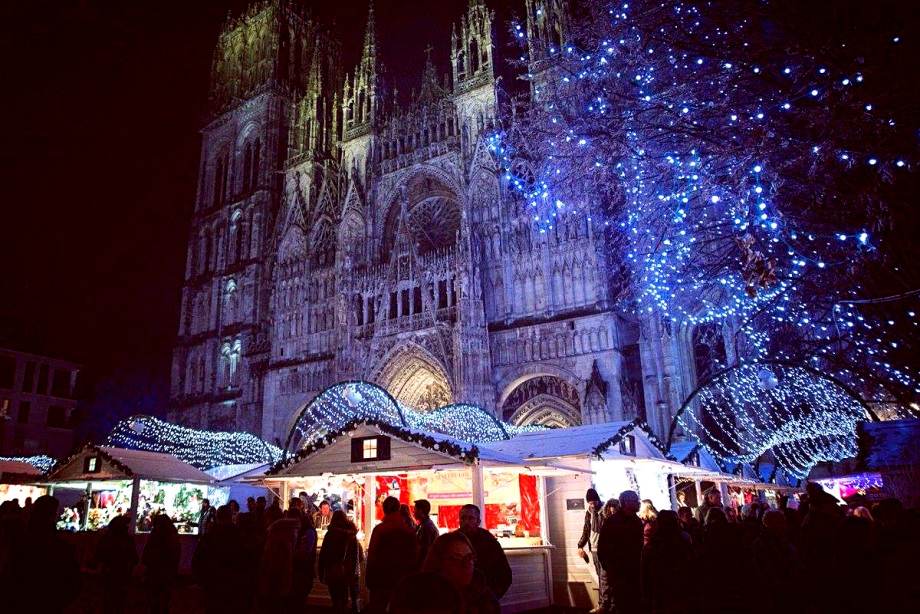
This screenshot has width=920, height=614. I want to click on arched frames, so click(498, 426), click(391, 417).